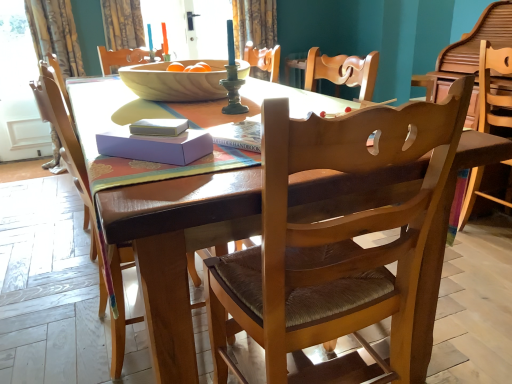
Question: Does wooden table at center have a larger size compared to white paper book at center?

Choices:
 (A) yes
 (B) no

Answer: (A)

Question: Is white paper book at center located within wooden table at center?

Choices:
 (A) yes
 (B) no

Answer: (B)

Question: Is wooden table at center smaller than white paper book at center?

Choices:
 (A) yes
 (B) no

Answer: (B)

Question: From a real-world perspective, is wooden table at center located higher than white paper book at center?

Choices:
 (A) no
 (B) yes

Answer: (A)

Question: From the image's perspective, is wooden table at center over white paper book at center?

Choices:
 (A) no
 (B) yes

Answer: (A)

Question: Do you think wooden chair with woven seat at center, which is counted as the second chair, starting from the right, is within white paper book at center, or outside of it?

Choices:
 (A) inside
 (B) outside

Answer: (B)

Question: Considering the positions of point (254, 266) and point (162, 125), is point (254, 266) closer or farther from the camera than point (162, 125)?

Choices:
 (A) closer
 (B) farther

Answer: (B)

Question: Relative to white paper book at center, is wooden chair with woven seat at center, acting as the second chair starting from the left, in front or behind?

Choices:
 (A) behind
 (B) front

Answer: (B)

Question: Looking at their shapes, would you say wooden chair with woven seat at center, which is counted as the second chair, starting from the right, is wider or thinner than white paper book at center?

Choices:
 (A) wide
 (B) thin

Answer: (A)

Question: Considering the positions of lavender cardboard box at center and wooden table at center in the image, is lavender cardboard box at center taller or shorter than wooden table at center?

Choices:
 (A) tall
 (B) short

Answer: (B)

Question: From a real-world perspective, is lavender cardboard box at center above or below wooden table at center?

Choices:
 (A) below
 (B) above

Answer: (B)

Question: Considering the relative positions of lavender cardboard box at center and wooden table at center in the image provided, is lavender cardboard box at center to the left or to the right of wooden table at center?

Choices:
 (A) right
 (B) left

Answer: (A)

Question: In terms of width, does lavender cardboard box at center look wider or thinner when compared to wooden table at center?

Choices:
 (A) wide
 (B) thin

Answer: (B)

Question: Considering the positions of wooden chair with woven seat at center, which is counted as the second chair, starting from the right, and wooden bowl at center in the image, is wooden chair with woven seat at center, which is counted as the second chair, starting from the right, taller or shorter than wooden bowl at center?

Choices:
 (A) tall
 (B) short

Answer: (A)

Question: Is wooden chair with woven seat at center, acting as the second chair starting from the left, inside the boundaries of wooden bowl at center, or outside?

Choices:
 (A) inside
 (B) outside

Answer: (B)